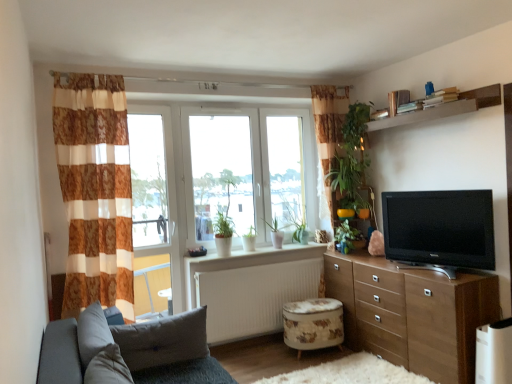
Question: From the image's perspective, is transparent glass window at center located beneath white plastic window frame at left?

Choices:
 (A) no
 (B) yes

Answer: (A)

Question: Is transparent glass window at center positioned before white plastic window frame at left?

Choices:
 (A) yes
 (B) no

Answer: (B)

Question: Is transparent glass window at center aimed at white plastic window frame at left?

Choices:
 (A) yes
 (B) no

Answer: (B)

Question: Does transparent glass window at center have a smaller size compared to white plastic window frame at left?

Choices:
 (A) yes
 (B) no

Answer: (B)

Question: Is the depth of transparent glass window at center greater than that of white plastic window frame at left?

Choices:
 (A) no
 (B) yes

Answer: (B)

Question: Is gray fabric pillow at lower left taller or shorter than floral fabric ottoman at lower center?

Choices:
 (A) short
 (B) tall

Answer: (A)

Question: Based on their sizes in the image, would you say gray fabric pillow at lower left is bigger or smaller than floral fabric ottoman at lower center?

Choices:
 (A) small
 (B) big

Answer: (A)

Question: From the image's perspective, relative to floral fabric ottoman at lower center, is gray fabric pillow at lower left above or below?

Choices:
 (A) above
 (B) below

Answer: (A)

Question: From a real-world perspective, is gray fabric pillow at lower left above or below floral fabric ottoman at lower center?

Choices:
 (A) above
 (B) below

Answer: (A)

Question: From the image's perspective, relative to floral fabric ottoman at lower center, is black glossy tv at right above or below?

Choices:
 (A) below
 (B) above

Answer: (B)

Question: Relative to floral fabric ottoman at lower center, is black glossy tv at right in front or behind?

Choices:
 (A) behind
 (B) front

Answer: (B)

Question: In the image, is black glossy tv at right on the left side or the right side of floral fabric ottoman at lower center?

Choices:
 (A) left
 (B) right

Answer: (B)

Question: Looking at their shapes, would you say black glossy tv at right is wider or thinner than floral fabric ottoman at lower center?

Choices:
 (A) wide
 (B) thin

Answer: (B)

Question: Would you say green matte plant at center, which is the first plant from back to front, is to the left or to the right of transparent glass window at center in the picture?

Choices:
 (A) right
 (B) left

Answer: (A)

Question: Is green matte plant at center, which is the 2th plant from front to back, wider or thinner than transparent glass window at center?

Choices:
 (A) thin
 (B) wide

Answer: (A)